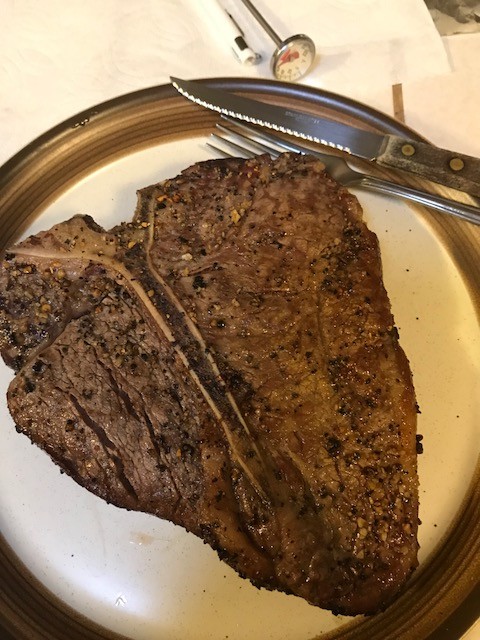
Where is `plate above steak`? plate above steak is located at coordinates (96, 177).